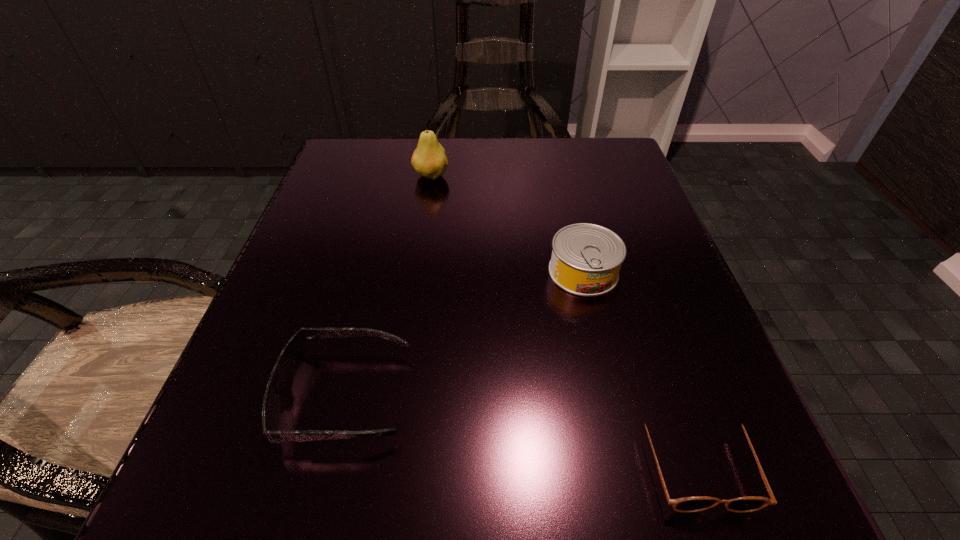
Locate an element on the screen. The height and width of the screenshot is (540, 960). free region at the near right corner of the desktop is located at coordinates (657, 451).

Locate an element on the screen. vacant area that lies between the pear and the shorter sunglasses is located at coordinates (564, 318).

Find the location of a particular element. This screenshot has height=540, width=960. vacant area that lies between the third nearest object and the taller sunglasses is located at coordinates (465, 334).

Where is `vacant space that is in between the pear and the can`? vacant space that is in between the pear and the can is located at coordinates (507, 224).

Where is `free space between the left sunglasses and the can`? free space between the left sunglasses and the can is located at coordinates (465, 334).

Identify the location of empty location between the shorter sunglasses and the taller sunglasses. The width and height of the screenshot is (960, 540). (520, 428).

Where is `free space between the third nearest object and the pear`? Image resolution: width=960 pixels, height=540 pixels. free space between the third nearest object and the pear is located at coordinates (507, 224).

At what (x,y) coordinates should I click in order to perform the action: click on free area in between the tallest object and the left sunglasses. Please return your answer as a coordinate pair (x, y). Looking at the image, I should click on (388, 286).

Locate an element on the screen. The image size is (960, 540). free spot between the right sunglasses and the taller sunglasses is located at coordinates (520, 428).

Find the location of `vacant area that lies between the can and the shortest object`. vacant area that lies between the can and the shortest object is located at coordinates (639, 366).